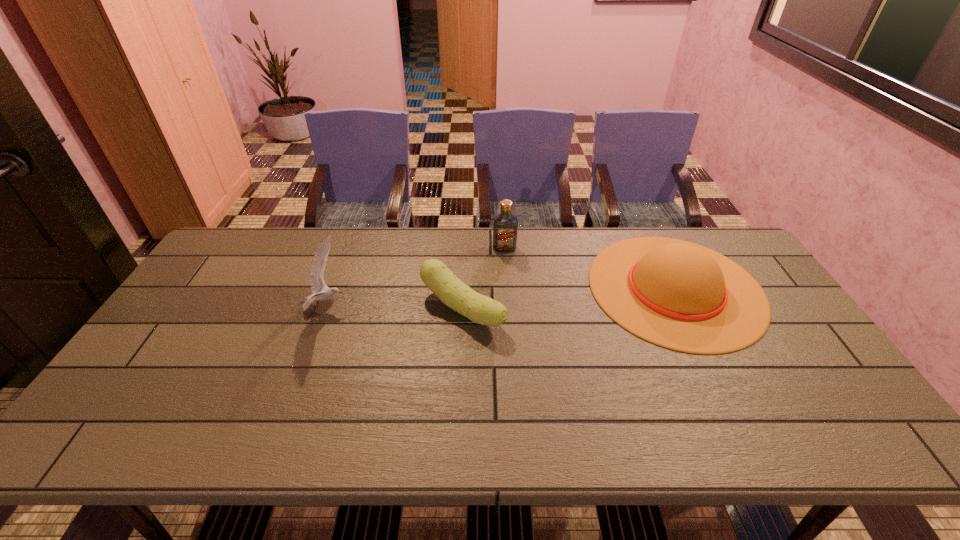
At what (x,y) coordinates should I click in order to perform the action: click on sombrero present at the far edge. Please return your answer as a coordinate pair (x, y). The height and width of the screenshot is (540, 960). Looking at the image, I should click on [x=682, y=296].

The image size is (960, 540). Find the location of `object at the right edge`. object at the right edge is located at coordinates (682, 296).

You are a GUI agent. You are given a task and a screenshot of the screen. Output one action in this format:
    pyautogui.click(x=<x>, y=<y>)
    Task: Click on the object that is at the far right corner
    The image size is (960, 540).
    Given the screenshot: What is the action you would take?
    pyautogui.click(x=682, y=296)

At what (x,y) coordinates should I click in order to perform the action: click on free space at the far edge of the desktop. Please return your answer as a coordinate pair (x, y). Looking at the image, I should click on (445, 234).

At what (x,y) coordinates should I click in order to perform the action: click on free space at the near edge of the desktop. Please return your answer as a coordinate pair (x, y). The width and height of the screenshot is (960, 540). Looking at the image, I should click on (257, 414).

Locate an element on the screen. vacant space at the left edge of the desktop is located at coordinates (191, 342).

Where is `vacant area at the right edge of the desktop`? The height and width of the screenshot is (540, 960). vacant area at the right edge of the desktop is located at coordinates (836, 400).

Image resolution: width=960 pixels, height=540 pixels. In the image, there is a desktop. Find the location of `vacant area at the far left corner`. vacant area at the far left corner is located at coordinates (212, 271).

Locate an element on the screen. This screenshot has height=540, width=960. empty location between the second shortest object and the gull is located at coordinates pos(500,298).

Identify the location of free space between the gull and the cucumber. The height and width of the screenshot is (540, 960). (394, 308).